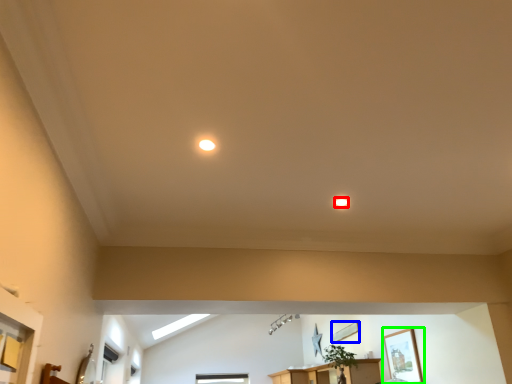
Question: Which is farther away from lighting (highlighted by a red box)? picture frame (highlighted by a blue box) or picture frame (highlighted by a green box)?

Choices:
 (A) picture frame
 (B) picture frame

Answer: (A)